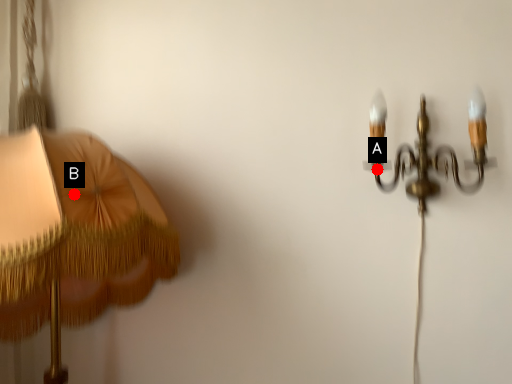
Question: Two points are circled on the image, labeled by A and B beside each circle. Which point appears closest to the camera in this image?

Choices:
 (A) A is closer
 (B) B is closer

Answer: (B)